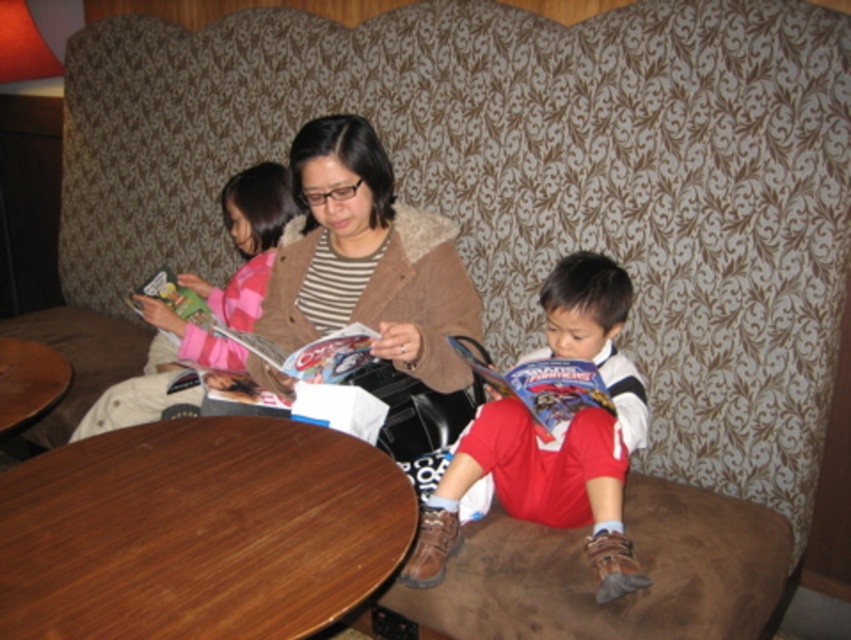
You are a photographer trying to capture a closeup of the red cotton shirt at center and the matte green magazine at upper left. Which object should you focus on first if you want to ensure both are in focus without adjusting your camera settings?

The red cotton shirt at center is much taller than the matte green magazine at upper left, so focusing on the taller object first would help maintain focus on both.